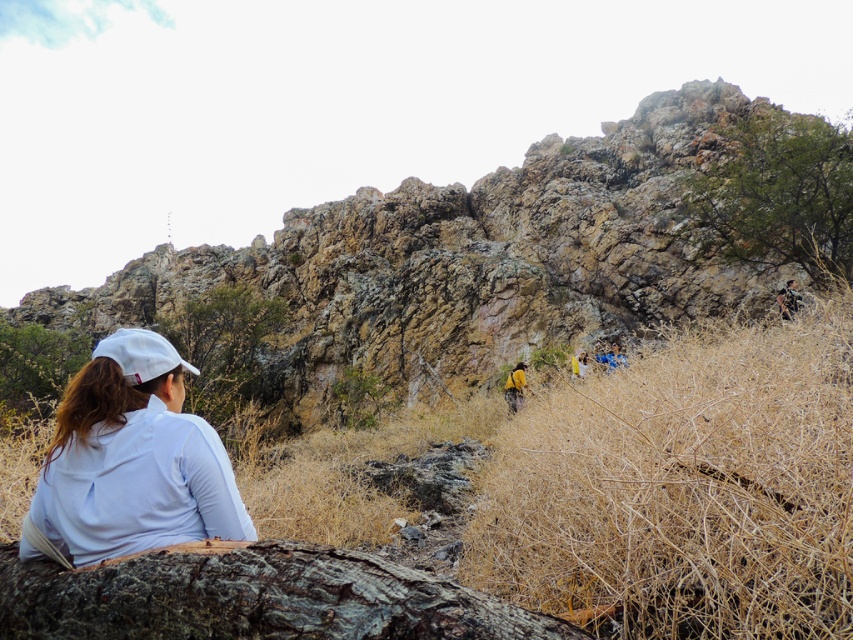
Question: Which of the following is the farthest from the observer?

Choices:
 (A) blue fabric at center
 (B) white matte shirt at lower left
 (C) dry straw at center
 (D) rugged rock formation at upper center

Answer: (D)

Question: Which object appears closest to the camera in this image?

Choices:
 (A) blue fabric at center
 (B) dark brown rough bark at lower center
 (C) rugged rock formation at upper center

Answer: (B)

Question: Is dark brown rough bark at lower center to the left of blue fabric at center from the viewer's perspective?

Choices:
 (A) no
 (B) yes

Answer: (B)

Question: Which object is the closest to the white matte shirt at lower left?

Choices:
 (A) blue fabric at center
 (B) rugged rock formation at upper center
 (C) dark brown rough bark at lower center

Answer: (C)

Question: Is rugged rock formation at upper center above blue fabric at center?

Choices:
 (A) no
 (B) yes

Answer: (B)

Question: Is white matte shirt at lower left above blue fabric at center?

Choices:
 (A) no
 (B) yes

Answer: (A)